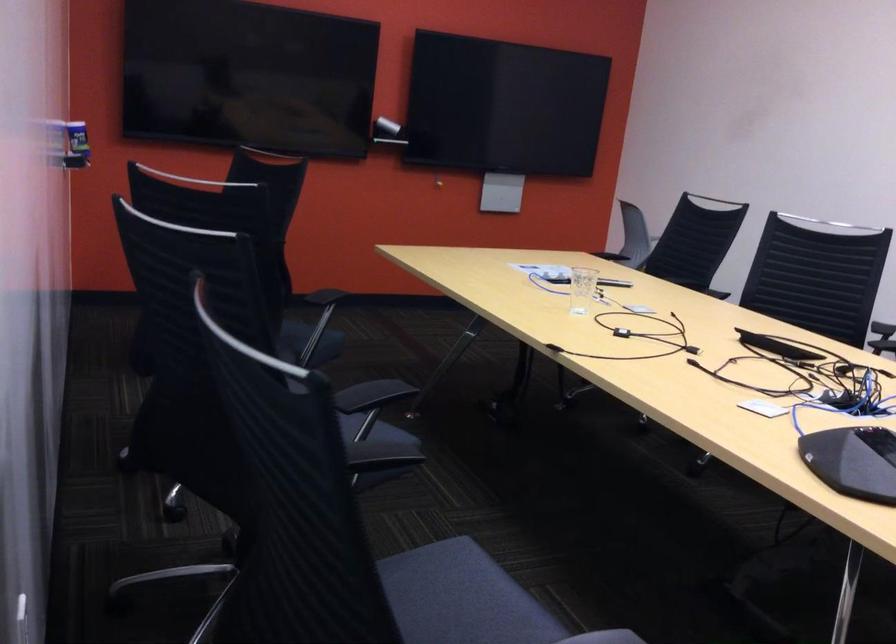
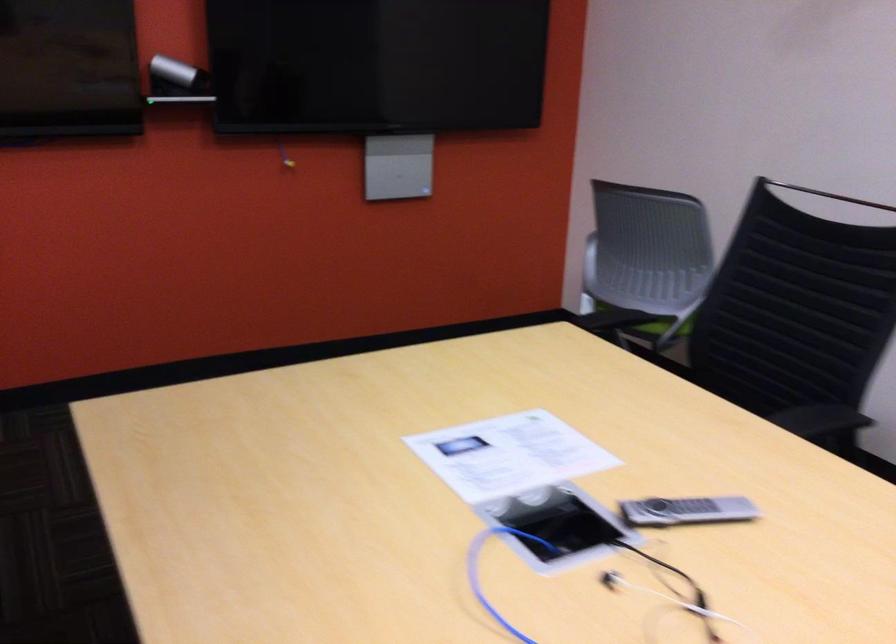
In the second image, find the point that corresponds to pixel 565 281 in the first image.

(576, 583)